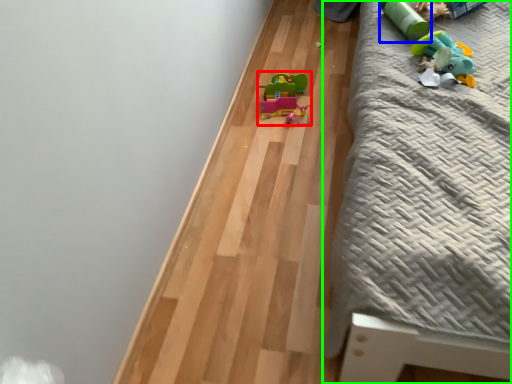
Question: Which object is the closest to the toy (highlighted by a red box)? Choose among these: toy (highlighted by a blue box) or furniture (highlighted by a green box).

Choices:
 (A) toy
 (B) furniture

Answer: (A)